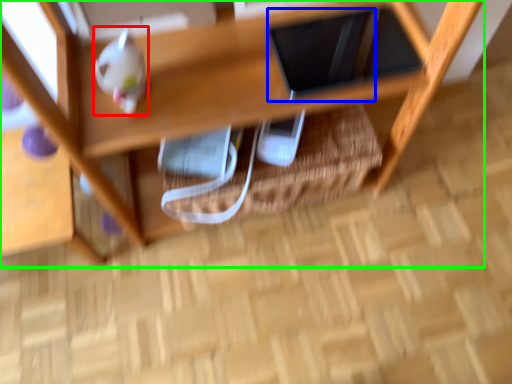
Question: Estimate the real-world distances between objects in this image. Which object is farther from toy (highlighted by a red box), tablet computer (highlighted by a blue box) or shelf (highlighted by a green box)?

Choices:
 (A) tablet computer
 (B) shelf

Answer: (A)